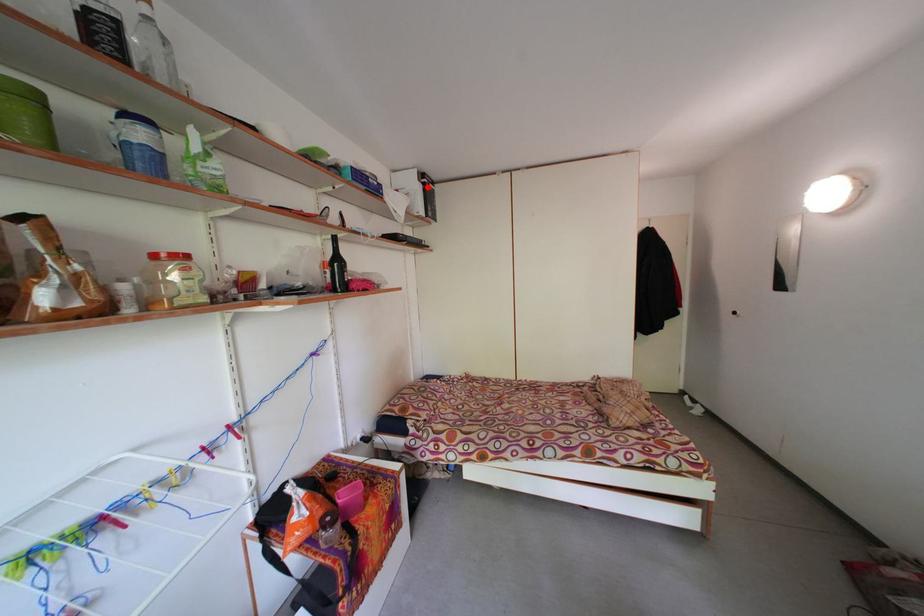
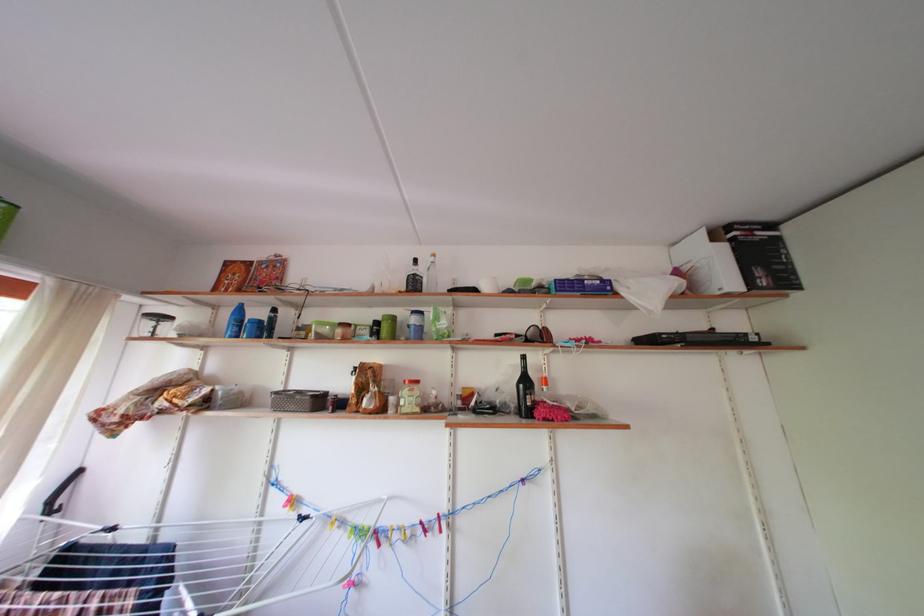
Where in the second image is the point corresponding to the highlighted location from the first image?

(721, 246)